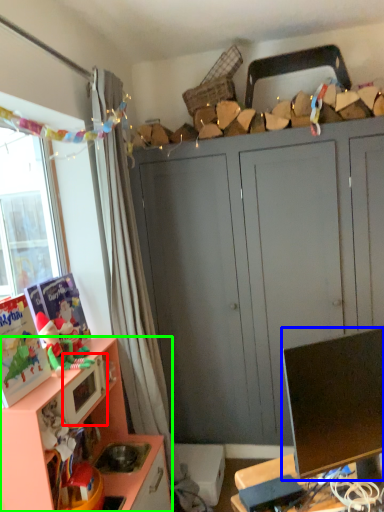
Question: Estimate the real-world distances between objects in this image. Which object is farther from microwave oven (highlighted by a red box), television (highlighted by a blue box) or cabinetry (highlighted by a green box)?

Choices:
 (A) television
 (B) cabinetry

Answer: (A)